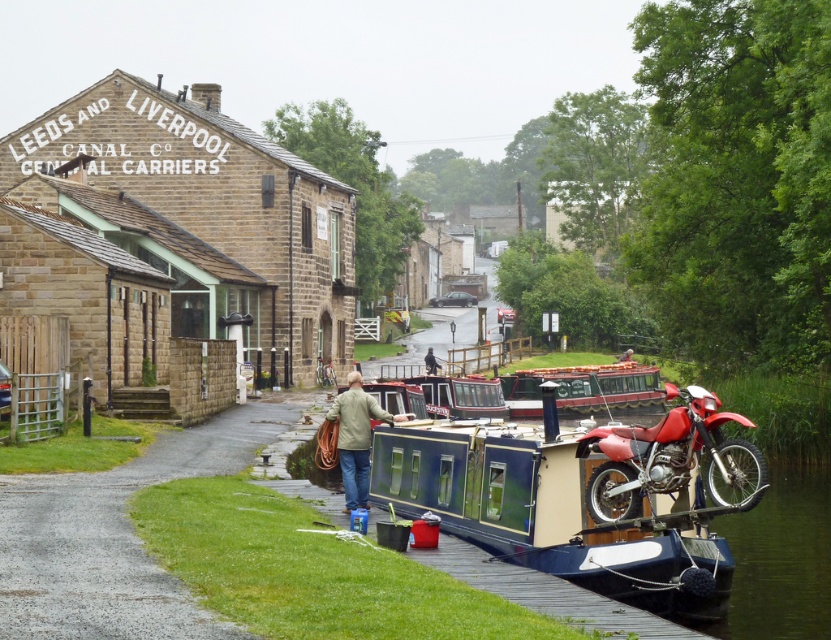
Question: Which point is closer to the camera?

Choices:
 (A) blue polished wood barge at center
 (B) silver metallic bicycle at center

Answer: (A)

Question: Can you confirm if red matte motorcycle at right is smaller than khaki fabric jacket at center?

Choices:
 (A) yes
 (B) no

Answer: (B)

Question: Is blue polished wood barge at center thinner than red matte motorcycle at right?

Choices:
 (A) yes
 (B) no

Answer: (A)

Question: Can you confirm if khaki fabric jacket at center is wider than silver metallic bicycle at center?

Choices:
 (A) no
 (B) yes

Answer: (B)

Question: Estimate the real-world distances between objects in this image. Which object is closer to the light brown leather jacket at center?

Choices:
 (A) khaki fabric jacket at center
 (B) red matte motorcycle at right
 (C) blue polished wood barge at center

Answer: (A)

Question: Which object is farther from the camera taking this photo?

Choices:
 (A) light brown leather jacket at center
 (B) red matte motorcycle at right
 (C) blue polished wood barge at center

Answer: (A)